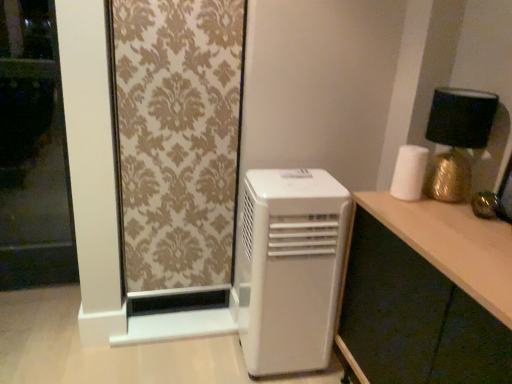
At what (x,y) coordinates should I click in order to perform the action: click on white plastic air conditioner at lower center. Please return your answer as a coordinate pair (x, y). The image size is (512, 384). Looking at the image, I should click on (289, 268).

Describe the element at coordinates (178, 138) in the screenshot. I see `gold damask fabric at upper left` at that location.

Where is `white matte paper towel at right`? white matte paper towel at right is located at coordinates (409, 173).

Where is `gold metallic table lamp at upper right`? The image size is (512, 384). gold metallic table lamp at upper right is located at coordinates (457, 139).

Find the location of a particular element. This screenshot has width=512, height=384. white plastic air conditioner at lower center is located at coordinates (289, 268).

Considering the sizes of objects transparent glass screen door at left and white plastic air conditioner at lower center in the image provided, who is shorter, transparent glass screen door at left or white plastic air conditioner at lower center?

With less height is white plastic air conditioner at lower center.

Consider the image. Would you say transparent glass screen door at left contains white plastic air conditioner at lower center?

No, white plastic air conditioner at lower center is not inside transparent glass screen door at left.

Consider the image. Does transparent glass screen door at left have a lesser width compared to white plastic air conditioner at lower center?

Correct, the width of transparent glass screen door at left is less than that of white plastic air conditioner at lower center.

Can you confirm if white matte paper towel at right is positioned to the left of gold damask fabric at upper left?

No, white matte paper towel at right is not to the left of gold damask fabric at upper left.

How many degrees apart are the facing directions of white matte paper towel at right and gold damask fabric at upper left?

They differ by 90.4 degrees in their facing directions.

Is point (411, 170) positioned in front of point (234, 12)?

Yes, it is.

Based on the photo, are white matte paper towel at right and gold damask fabric at upper left located far from each other?

No, white matte paper towel at right is in close proximity to gold damask fabric at upper left.

Relative to white matte paper towel at right, is wooden desk at right in front or behind?

Visually, wooden desk at right is located in front of white matte paper towel at right.

Who is shorter, wooden desk at right or white matte paper towel at right?

white matte paper towel at right.

From the image's perspective, is wooden desk at right under white matte paper towel at right?

Correct, wooden desk at right appears lower than white matte paper towel at right in the image.

Is wooden desk at right looking in the opposite direction of white matte paper towel at right?

That's not correct — wooden desk at right is not looking away from white matte paper towel at right.

Does gold metallic table lamp at upper right touch transparent glass screen door at left?

gold metallic table lamp at upper right and transparent glass screen door at left are not in contact.

Which is in front, gold metallic table lamp at upper right or transparent glass screen door at left?

gold metallic table lamp at upper right.

Which is behind, point (467, 186) or point (14, 113)?

Point (14, 113)

From a real-world perspective, who is located higher, gold metallic table lamp at upper right or transparent glass screen door at left?

In real-world perspective, gold metallic table lamp at upper right is above.

Looking at this image, is wooden desk at right taller or shorter than white plastic air conditioner at lower center?

wooden desk at right is shorter than white plastic air conditioner at lower center.

From the image's perspective, relative to white plastic air conditioner at lower center, is wooden desk at right above or below?

Clearly, from the image's perspective, wooden desk at right is below white plastic air conditioner at lower center.

Is wooden desk at right oriented towards white plastic air conditioner at lower center?

No, wooden desk at right is not aimed at white plastic air conditioner at lower center.

Considering the sizes of objects transparent glass screen door at left and gold damask fabric at upper left in the image provided, who is bigger, transparent glass screen door at left or gold damask fabric at upper left?

With larger size is gold damask fabric at upper left.

Consider the image. Is transparent glass screen door at left beside gold damask fabric at upper left?

transparent glass screen door at left and gold damask fabric at upper left are not in contact.

Is point (24, 194) positioned after point (173, 130)?

Yes, it is.

Does transparent glass screen door at left have a greater width compared to gold damask fabric at upper left?

No.

From the image's perspective, who appears lower, white plastic air conditioner at lower center or gold metallic table lamp at upper right?

white plastic air conditioner at lower center.

Are white plastic air conditioner at lower center and gold metallic table lamp at upper right located far from each other?

No, there isn't a large distance between white plastic air conditioner at lower center and gold metallic table lamp at upper right.

Could you tell me if white plastic air conditioner at lower center is facing gold metallic table lamp at upper right?

No, white plastic air conditioner at lower center is not turned towards gold metallic table lamp at upper right.

Which is behind, point (310, 365) or point (487, 115)?

Positioned behind is point (310, 365).

Identify the location of screen door above the white plastic air conditioner at lower center (from the image's perspective). This screenshot has height=384, width=512. (33, 152).

Where is `curtain below the white matte paper towel at right (from a real-world perspective)`? Image resolution: width=512 pixels, height=384 pixels. curtain below the white matte paper towel at right (from a real-world perspective) is located at coordinates (178, 138).

Looking at this image, considering their positions, is white matte paper towel at right positioned closer to white plastic air conditioner at lower center than gold metallic table lamp at upper right?

white matte paper towel at right is positioned closer to the anchor white plastic air conditioner at lower center.

From the image, which object appears to be farther from wooden desk at right, transparent glass screen door at left or gold metallic table lamp at upper right?

transparent glass screen door at left is further to wooden desk at right.

When comparing their distances from white matte paper towel at right, does gold damask fabric at upper left or transparent glass screen door at left seem further?

transparent glass screen door at left.

Which object lies further to the anchor point white plastic air conditioner at lower center, gold damask fabric at upper left or transparent glass screen door at left?

Based on the image, transparent glass screen door at left appears to be further to white plastic air conditioner at lower center.

Which object lies further to the anchor point gold damask fabric at upper left, wooden desk at right or white matte paper towel at right?

The object further to gold damask fabric at upper left is white matte paper towel at right.

Considering their positions, is gold metallic table lamp at upper right positioned further to white matte paper towel at right than white plastic air conditioner at lower center?

white plastic air conditioner at lower center.

Looking at the image, which one is located further to white matte paper towel at right, transparent glass screen door at left or gold metallic table lamp at upper right?

Based on the image, transparent glass screen door at left appears to be further to white matte paper towel at right.

From the picture: Considering their positions, is white plastic air conditioner at lower center positioned further to white matte paper towel at right than gold metallic table lamp at upper right?

The object further to white matte paper towel at right is white plastic air conditioner at lower center.

Locate an element on the screen. The image size is (512, 384). curtain located between transparent glass screen door at left and wooden desk at right in the left-right direction is located at coordinates (178, 138).

You are a GUI agent. You are given a task and a screenshot of the screen. Output one action in this format:
    pyautogui.click(x=<x>, y=<y>)
    Task: Click on the paper towel between gold damask fabric at upper left and wooden desk at right from left to right
    
    Given the screenshot: What is the action you would take?
    pyautogui.click(x=409, y=173)

Locate an element on the screen. The height and width of the screenshot is (384, 512). paper towel between white plastic air conditioner at lower center and gold metallic table lamp at upper right from left to right is located at coordinates (409, 173).

The image size is (512, 384). I want to click on curtain between transparent glass screen door at left and gold metallic table lamp at upper right, so click(178, 138).